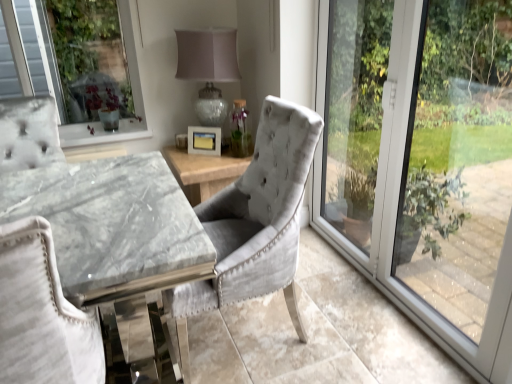
Question: Does point (201, 124) appear closer or farther from the camera than point (209, 129)?

Choices:
 (A) closer
 (B) farther

Answer: (B)

Question: Considering the positions of matte glass table lamp at center and white matte picture frame at center in the image, is matte glass table lamp at center wider or thinner than white matte picture frame at center?

Choices:
 (A) wide
 (B) thin

Answer: (A)

Question: Which is farther from the velvet grey chair at center, arranged as the first chair when viewed from the right?

Choices:
 (A) white fabric chair at left, which appears as the second chair when viewed from the right
 (B) transparent glass window at right
 (C) white matte picture frame at center
 (D) matte glass table lamp at center

Answer: (C)

Question: Based on their relative distances, which object is nearer to the transparent glass window at right?

Choices:
 (A) matte glass table lamp at center
 (B) white matte picture frame at center
 (C) velvet grey chair at center, placed as the 2th chair when sorted from left to right
 (D) white fabric chair at left, which appears as the second chair when viewed from the right

Answer: (C)